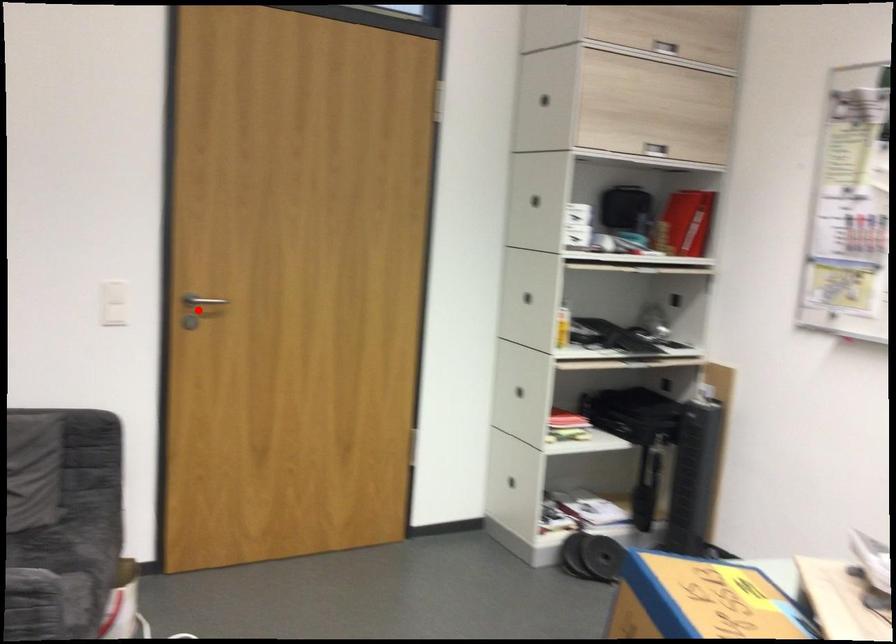
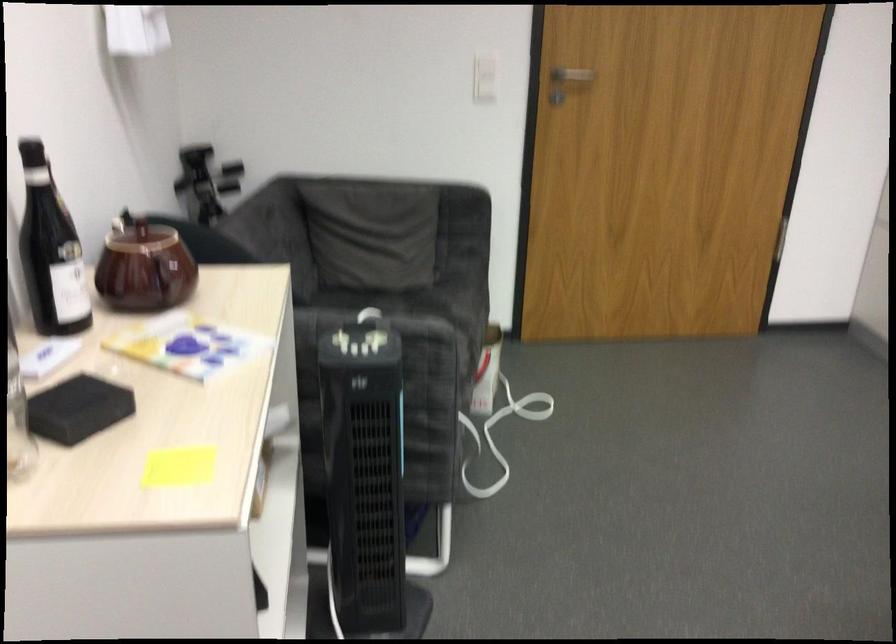
The point at the highlighted location is marked in the first image. Where is the corresponding point in the second image?

(569, 77)